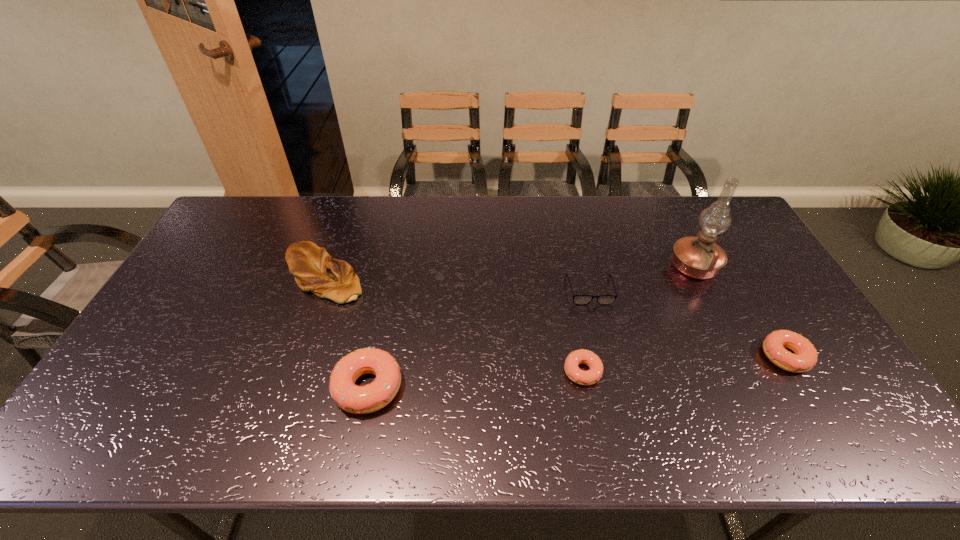
You are a GUI agent. You are given a task and a screenshot of the screen. Output one action in this format:
    pyautogui.click(x=<x>, y=<y>)
    Task: Click on the tallest doughnut
    
    Given the screenshot: What is the action you would take?
    pyautogui.click(x=352, y=398)

In order to click on the shortest doughnut in this screenshot , I will do `click(574, 373)`.

Identify the location of the fourth tallest object. (805, 357).

Identify the location of the rightmost doughnut. (805, 357).

At what (x,y) coordinates should I click in order to perform the action: click on bread. Please return your answer as a coordinate pair (x, y). The width and height of the screenshot is (960, 540). Looking at the image, I should click on (314, 269).

Find the location of a particular element. Image resolution: width=960 pixels, height=540 pixels. the tallest object is located at coordinates (700, 257).

This screenshot has height=540, width=960. Find the location of `spectacles`. spectacles is located at coordinates click(577, 299).

The width and height of the screenshot is (960, 540). I want to click on blank area located 0.060m on the left of the leftmost doughnut, so click(310, 388).

Where is `free space located on the left of the second doughnut from left to right`? The width and height of the screenshot is (960, 540). free space located on the left of the second doughnut from left to right is located at coordinates (409, 372).

Locate an element on the screen. Image resolution: width=960 pixels, height=540 pixels. blank area located on the left of the rightmost doughnut is located at coordinates (623, 356).